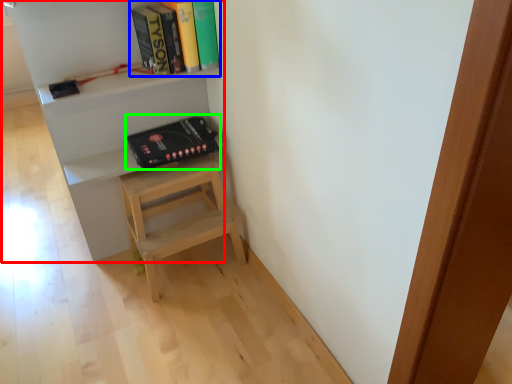
Question: Which object is the closest to the shelf (highlighted by a red box)? Choose among these: book (highlighted by a blue box) or paperback book (highlighted by a green box).

Choices:
 (A) book
 (B) paperback book

Answer: (B)